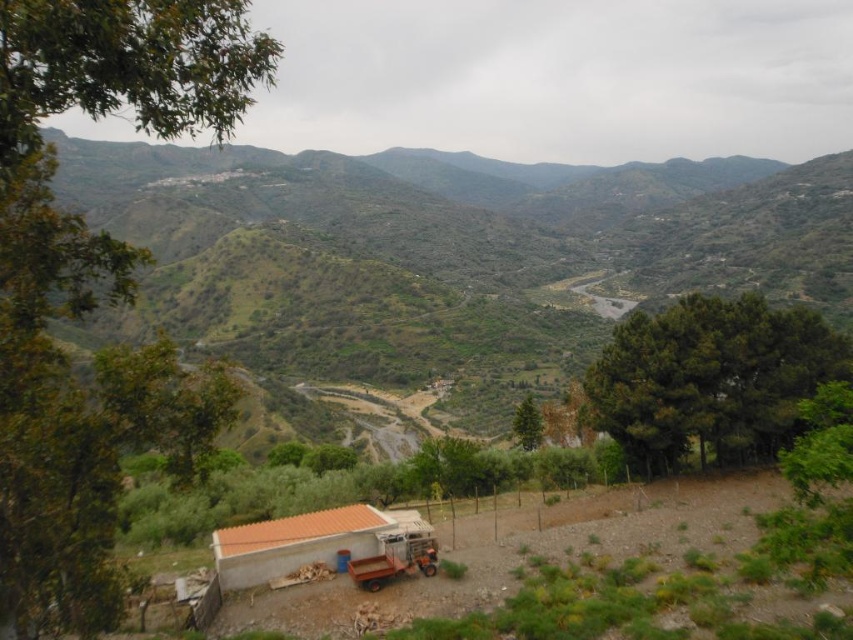
Question: Can you confirm if brown gravel dirt track at lower center is bigger than orange tile hut at lower center?

Choices:
 (A) no
 (B) yes

Answer: (B)

Question: Which point is closer to the camera taking this photo?

Choices:
 (A) (352, 541)
 (B) (612, 595)

Answer: (B)

Question: Is the position of brown gravel dirt track at lower center more distant than that of orange tile hut at lower center?

Choices:
 (A) no
 (B) yes

Answer: (A)

Question: Observing the image, what is the correct spatial positioning of brown gravel dirt track at lower center in reference to orange tile hut at lower center?

Choices:
 (A) left
 (B) right

Answer: (B)

Question: Which point is closer to the camera taking this photo?

Choices:
 (A) (415, 621)
 (B) (233, 545)

Answer: (A)